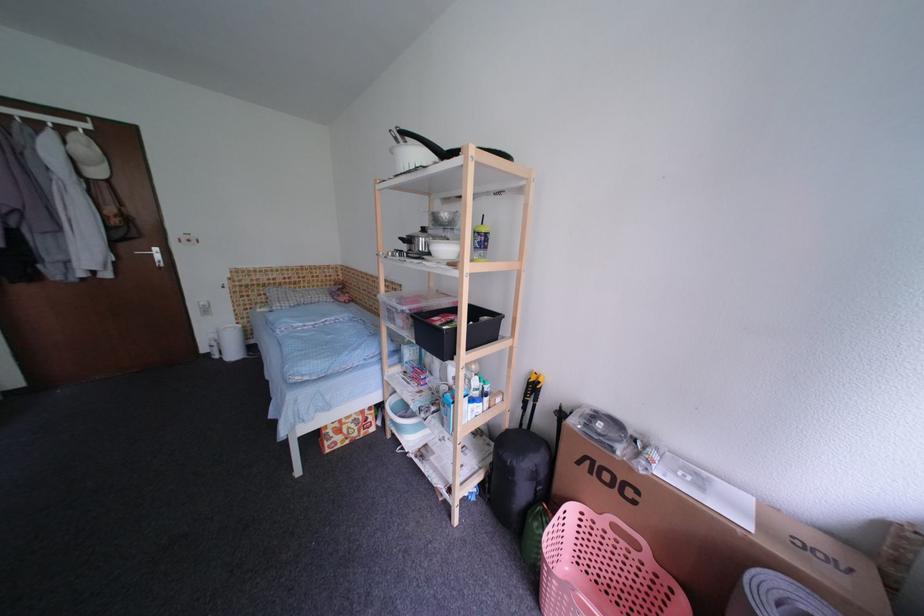
Find where to lift the small bucket handle. Please return your answer as a coordinate pair (x, y).

(403, 418)